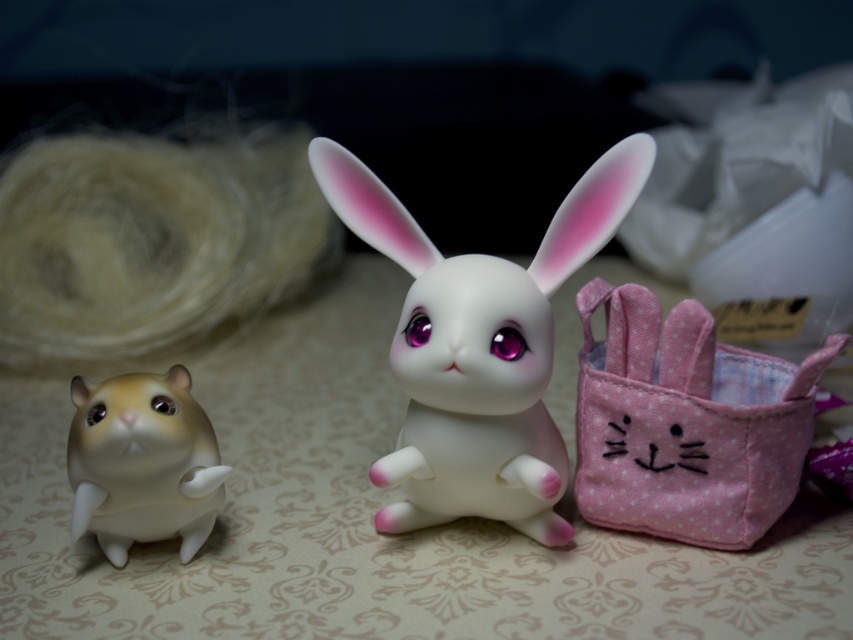
You are organizing a display and need to place a small toy inside the pink fabric basket at right. However, you also have the white glossy rabbit at center in the way. Can you still place the toy inside the basket without moving the rabbit?

The pink fabric basket at right is behind the white glossy rabbit at center, so you can still place the toy inside the basket without moving the rabbit because the basket is accessible from the front side.

You are a toy collector who wants to display both the white glossy rabbit at center and the matte white rabbit at center on a shelf. The shelf has a space that is exactly 12 inches wide. Can both rabbits fit side by side without overlapping?

The white glossy rabbit at center is 11.46 inches away from matte white rabbit at center, which means there is enough space between them to fit both on a 12 inch shelf. Yes, they can fit side by side without overlapping.

Based on the photo, you are a collector arranging two white rabbits on a shelf. The scene shows a white glossy rabbit at center and a matte white rabbit at center. Which rabbit should you move to ensure both are visible from the front?

You should move the matte white rabbit at center because it is behind the white glossy rabbit at center, so moving it forward would make both visible.